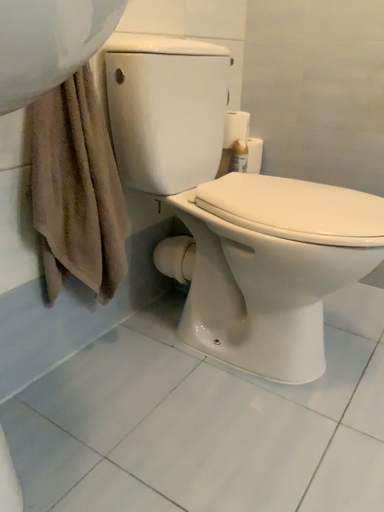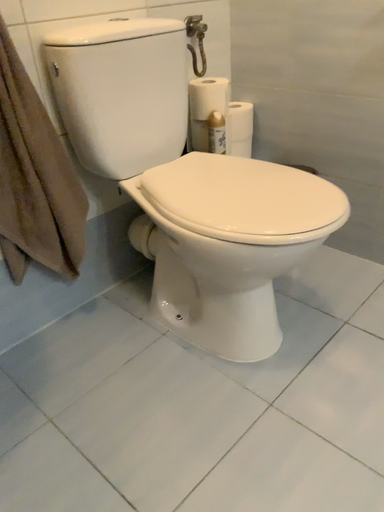
Question: How did the camera likely rotate when shooting the video?

Choices:
 (A) rotated upward
 (B) rotated downward

Answer: (B)